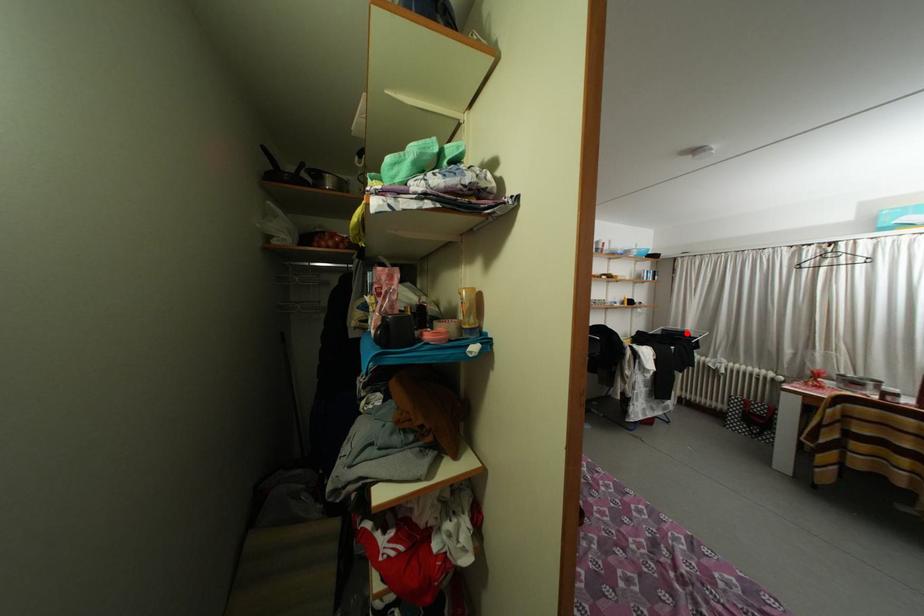
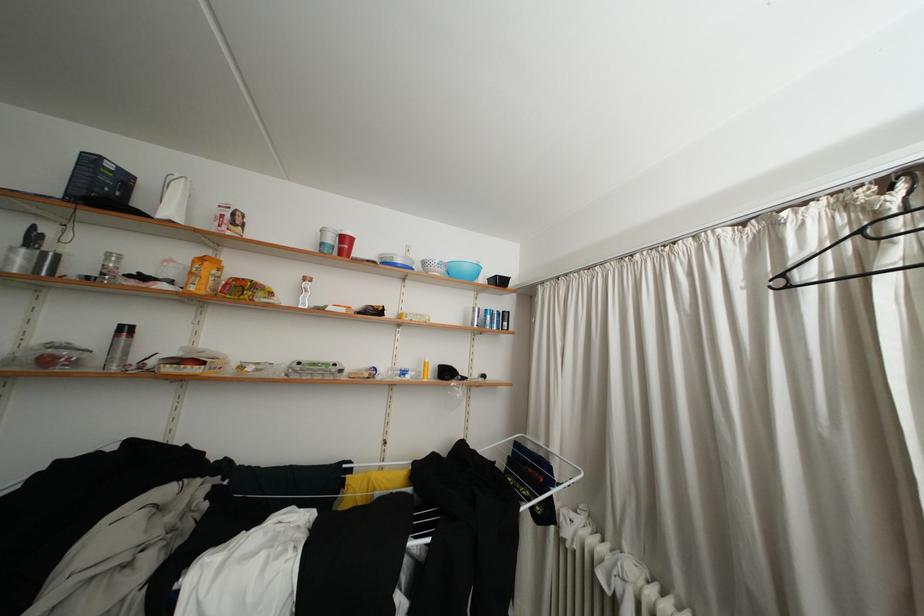
Where in the second image is the point corresponding to the highlighted location from the first image?

(550, 448)